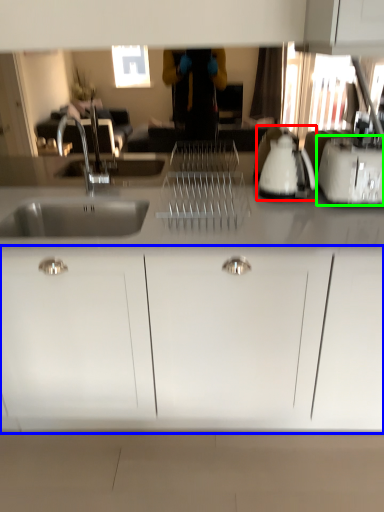
Question: Estimate the real-world distances between objects in this image. Which object is farther from appliance (highlighted by a red box), cabinetry (highlighted by a blue box) or toaster (highlighted by a green box)?

Choices:
 (A) cabinetry
 (B) toaster

Answer: (A)